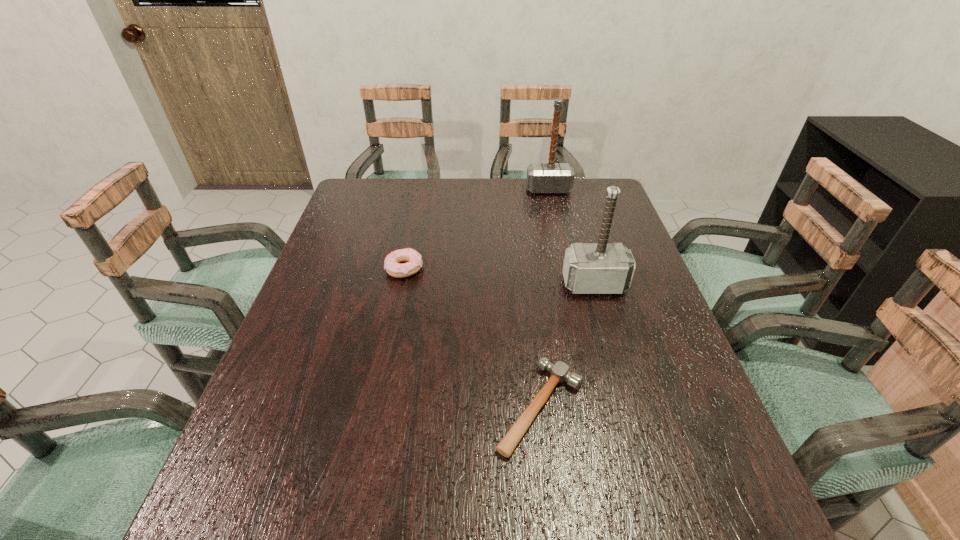
Locate an element on the screen. object present at the far edge is located at coordinates (551, 177).

Image resolution: width=960 pixels, height=540 pixels. I want to click on object that is at the far right corner, so click(551, 177).

In the image, there is a desktop. Where is `vacant space at the far edge`? vacant space at the far edge is located at coordinates tap(521, 205).

Where is `vacant space at the near edge of the desktop`? The image size is (960, 540). vacant space at the near edge of the desktop is located at coordinates (477, 539).

The width and height of the screenshot is (960, 540). I want to click on vacant region at the left edge of the desktop, so click(280, 435).

The image size is (960, 540). In order to click on free space at the right edge of the desktop in this screenshot , I will do `click(647, 441)`.

Locate an element on the screen. The height and width of the screenshot is (540, 960). free space between the farthest object and the doughnut is located at coordinates tap(476, 230).

Where is `free space between the leftmost object and the nearest hammer`? Image resolution: width=960 pixels, height=540 pixels. free space between the leftmost object and the nearest hammer is located at coordinates (472, 338).

Identify the location of vacant area that lies between the farthest hammer and the doughnut. (476, 230).

Find the location of a particular element. This screenshot has height=540, width=960. vacant space that's between the second nearest hammer and the nearest object is located at coordinates (567, 346).